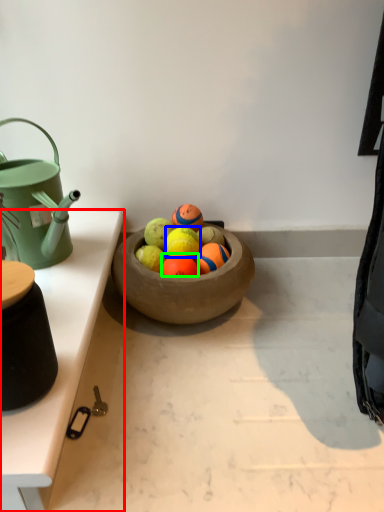
Question: Which object is the closest to the table (highlighted by a red box)? Choose among these: fruit (highlighted by a blue box) or fruit (highlighted by a green box).

Choices:
 (A) fruit
 (B) fruit

Answer: (B)